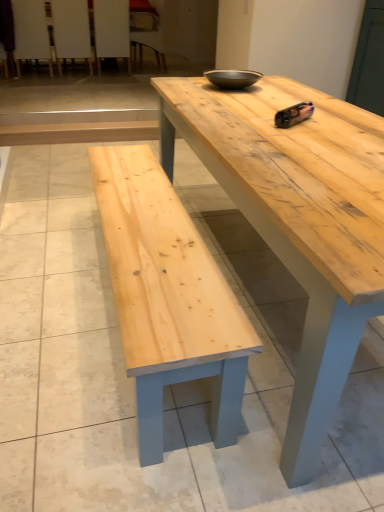
Question: From their relative heights in the image, would you say wooden chair at upper left, the 4th chair from the left, is taller or shorter than white wood chair at upper left, which is the 3th chair in left-to-right order?

Choices:
 (A) tall
 (B) short

Answer: (A)

Question: Considering their positions, is wooden chair at upper left, which is the 1th chair from right to left, located in front of or behind white wood chair at upper left, the second chair in the right-to-left sequence?

Choices:
 (A) behind
 (B) front

Answer: (A)

Question: Based on their relative distances, which object is farther from the natural wood table at center?

Choices:
 (A) wooden chair at upper left, which is the 1th chair from right to left
 (B) wooden chair at upper left, placed as the 3th chair when sorted from right to left
 (C) white wood chair at upper left, which is the 3th chair in left-to-right order
 (D) matte black bowl at center
 (E) wooden chair at upper left, positioned as the 1th chair in left-to-right order

Answer: (E)

Question: Considering the real-world distances, which object is farthest from the wooden chair at upper left, placed as the second chair when sorted from left to right?

Choices:
 (A) natural wood table at center
 (B) white wood chair at upper left, which is the 3th chair in left-to-right order
 (C) matte black bowl at center
 (D) wooden chair at upper left, positioned as the 1th chair in left-to-right order
 (E) wooden chair at upper left, which is the 1th chair from right to left

Answer: (A)